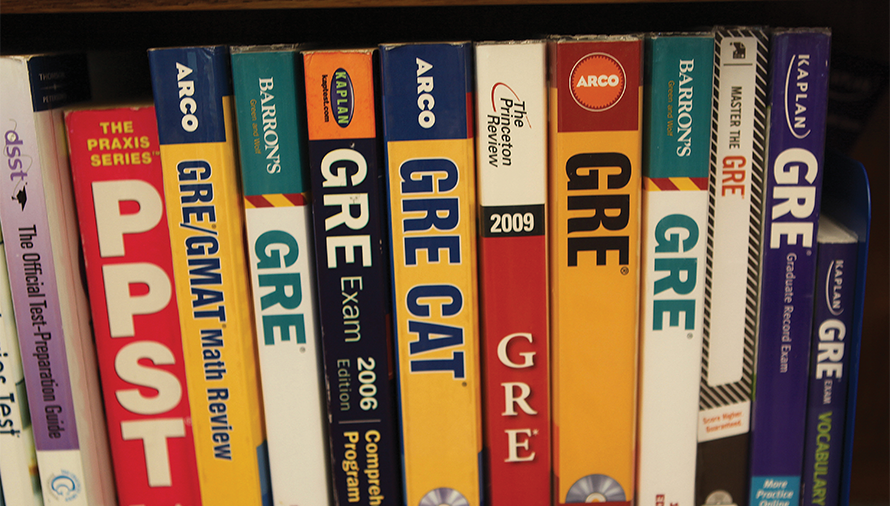
You are a GUI agent. You are given a task and a screenshot of the screen. Output one action in this format:
    pyautogui.click(x=<x>, y=<y>)
    Task: Click on the red books
    The width and height of the screenshot is (890, 506).
    Given the screenshot: What is the action you would take?
    pyautogui.click(x=142, y=167), pyautogui.click(x=520, y=293)